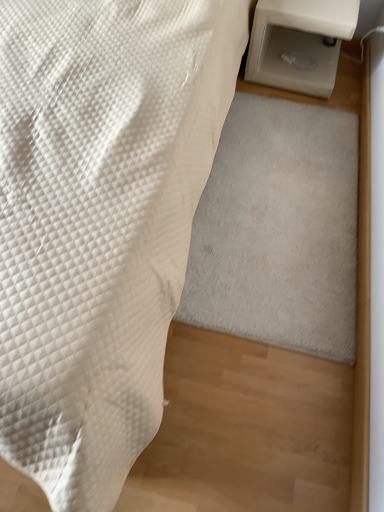
Where is `empty space that is ontop of white soft rug at lower right`? This screenshot has height=512, width=384. empty space that is ontop of white soft rug at lower right is located at coordinates (288, 195).